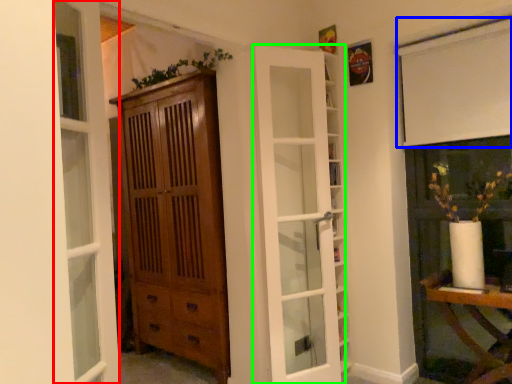
Question: Considering the real-world distances, which object is closest to window (highlighted by a red box)? curtain (highlighted by a blue box) or door (highlighted by a green box).

Choices:
 (A) curtain
 (B) door

Answer: (B)